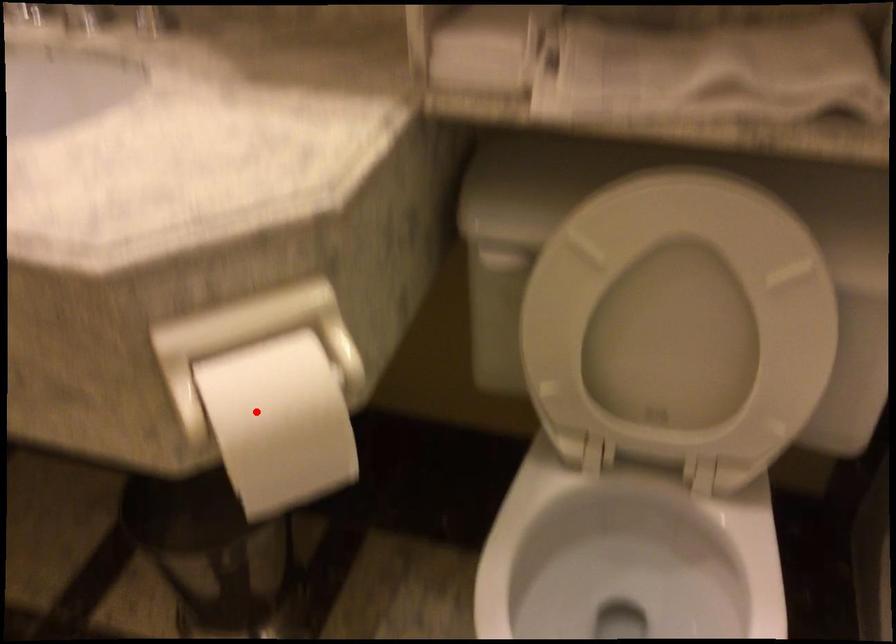
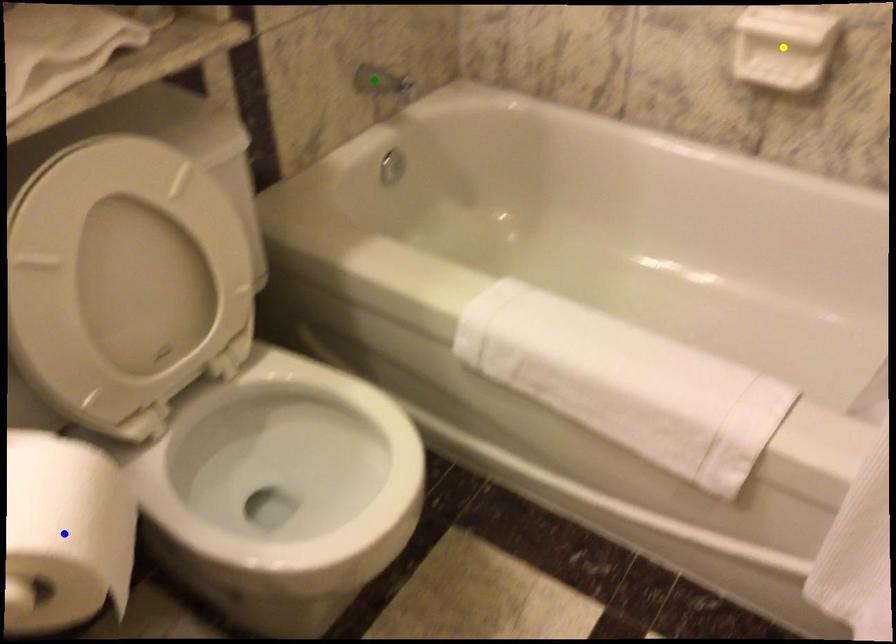
Question: I am providing you with two images of the same scene from different viewpoints. A red point is marked on the first image. You are given multiple points on the second image. Which point in image 2 represents the same 3d spot as the red point in image 1?

Choices:
 (A) blue point
 (B) green point
 (C) yellow point

Answer: (A)